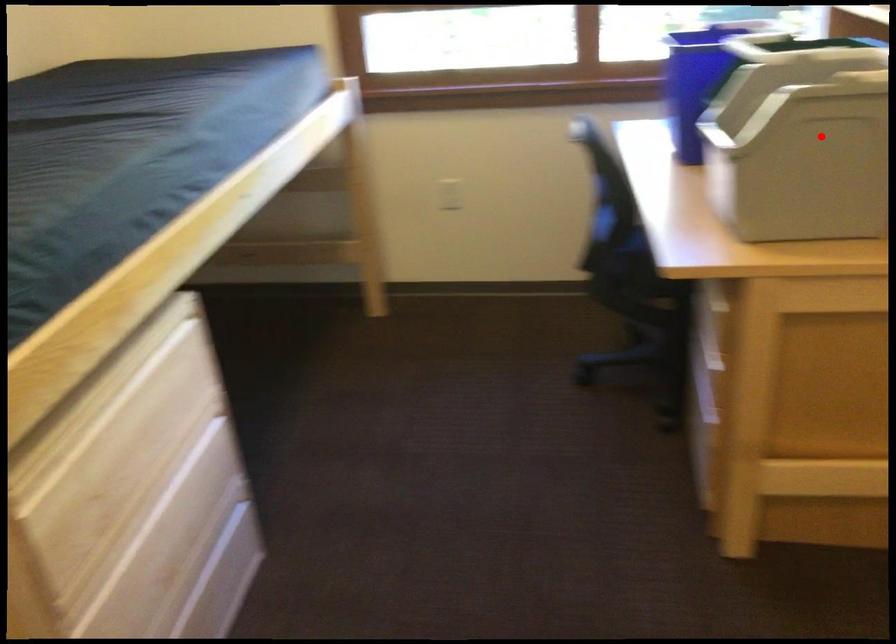
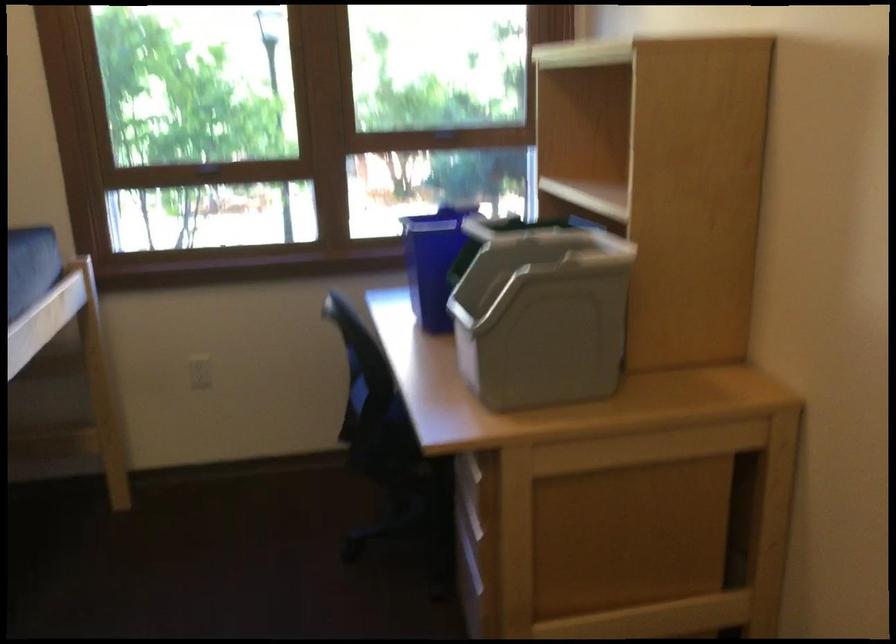
Question: I am providing you with two images of the same scene from different viewpoints. Given a red point in image1, look at the same physical point in image2. Is it:

Choices:
 (A) Closer to the viewpoint
 (B) Farther from the viewpoint

Answer: (B)